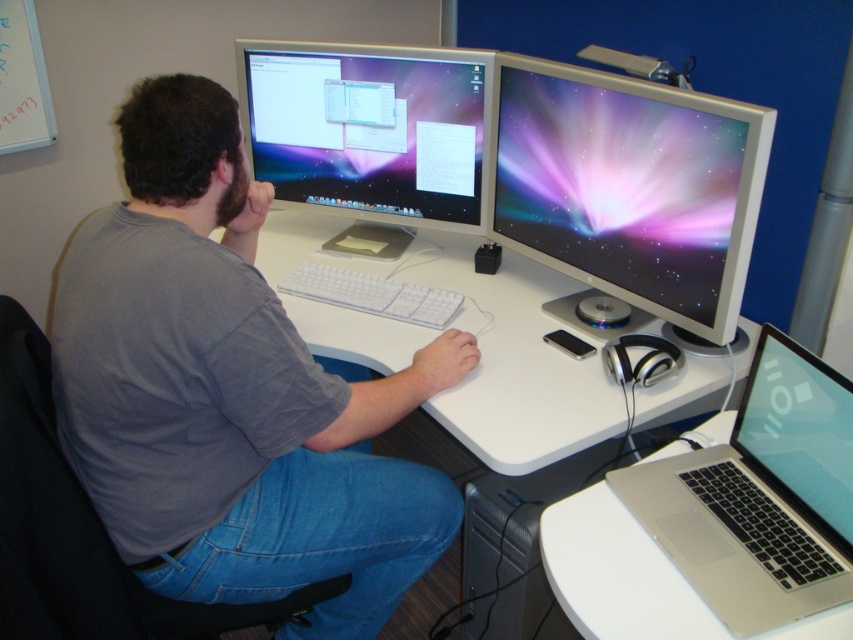
You are setting up a new desk arrangement and want to place a plant between the satin black monitor at center and the white plastic keyboard at center. Based on their sizes, which object should the plant be closer to?

The plant should be closer to the white plastic keyboard at center because the satin black monitor at center is taller than the white plastic keyboard at center, making the keyboard the shorter object.

You are standing in front of the workspace shown in the image. The white plastic computer desk at center is where the person is working. If you want to place a 3.5 feet wide box on the desk, will it fit? Please explain your reasoning based on the desk dimensions provided.

The white plastic computer desk at center is 4.06 feet from viewer. However, the question asks about the desk width, but the provided information only mentions the distance from the viewer, not the desk width. Therefore, it is impossible to determine if the box will fit based on the given data.